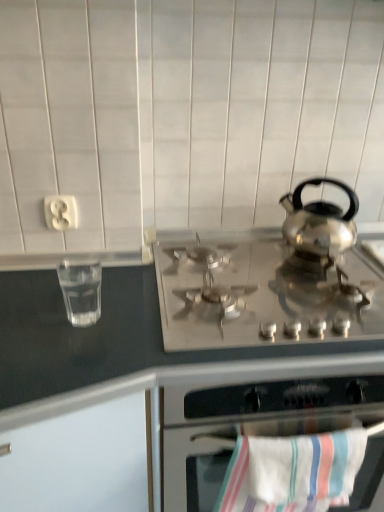
Question: Can you confirm if clear glass water at left is positioned to the right of satin silver gas stove at center?

Choices:
 (A) no
 (B) yes

Answer: (A)

Question: Could you tell me if clear glass water at left is facing satin silver gas stove at center?

Choices:
 (A) no
 (B) yes

Answer: (A)

Question: Does clear glass water at left have a lesser height compared to satin silver gas stove at center?

Choices:
 (A) no
 (B) yes

Answer: (A)

Question: From the image's perspective, is clear glass water at left on top of satin silver gas stove at center?

Choices:
 (A) no
 (B) yes

Answer: (A)

Question: Considering the relative sizes of clear glass water at left and satin silver gas stove at center in the image provided, is clear glass water at left bigger than satin silver gas stove at center?

Choices:
 (A) yes
 (B) no

Answer: (B)

Question: Considering the positions of striped cotton beach towel at lower center and satin silver gas stove at center in the image, is striped cotton beach towel at lower center taller or shorter than satin silver gas stove at center?

Choices:
 (A) short
 (B) tall

Answer: (B)

Question: In terms of width, does striped cotton beach towel at lower center look wider or thinner when compared to satin silver gas stove at center?

Choices:
 (A) thin
 (B) wide

Answer: (A)

Question: From a real-world perspective, relative to satin silver gas stove at center, is striped cotton beach towel at lower center vertically above or below?

Choices:
 (A) above
 (B) below

Answer: (B)

Question: Visually, is striped cotton beach towel at lower center positioned to the left or to the right of satin silver gas stove at center?

Choices:
 (A) left
 (B) right

Answer: (A)

Question: In the image, is striped cotton beach towel at lower center on the left side or the right side of stainless steel gas stove at center?

Choices:
 (A) right
 (B) left

Answer: (B)

Question: Which is correct: striped cotton beach towel at lower center is inside stainless steel gas stove at center, or outside of it?

Choices:
 (A) outside
 (B) inside

Answer: (B)

Question: From a real-world perspective, relative to stainless steel gas stove at center, is striped cotton beach towel at lower center vertically above or below?

Choices:
 (A) below
 (B) above

Answer: (B)

Question: Considering their positions, is striped cotton beach towel at lower center located in front of or behind stainless steel gas stove at center?

Choices:
 (A) behind
 (B) front

Answer: (A)

Question: Is point (64, 199) positioned closer to the camera than point (289, 465)?

Choices:
 (A) farther
 (B) closer

Answer: (A)

Question: From the image's perspective, is white plastic outlet at upper left above or below striped cotton beach towel at lower center?

Choices:
 (A) below
 (B) above

Answer: (B)